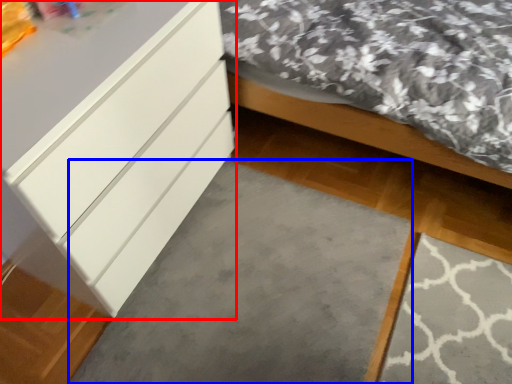
Question: Which object is further to the camera taking this photo, chest of drawers (highlighted by a red box) or concrete (highlighted by a blue box)?

Choices:
 (A) chest of drawers
 (B) concrete

Answer: (B)